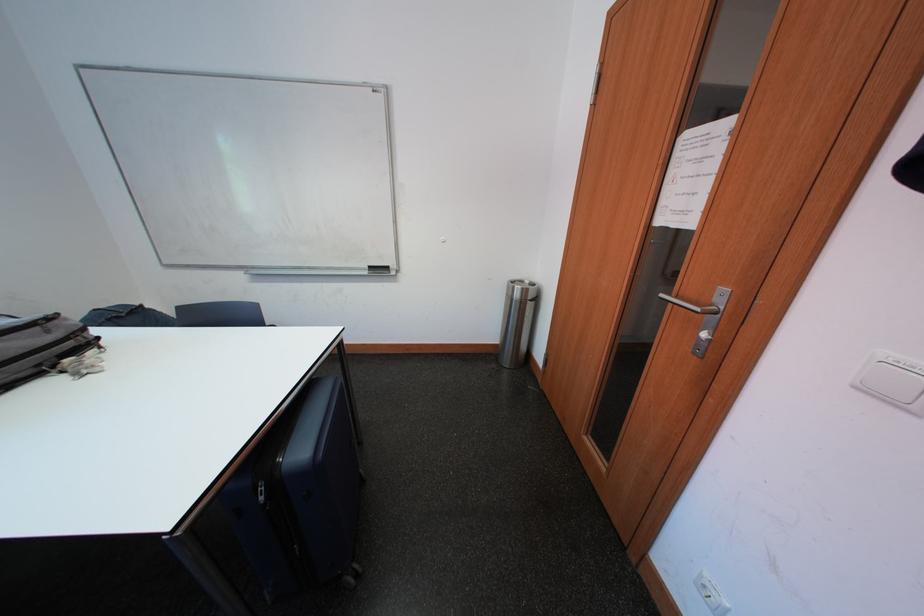
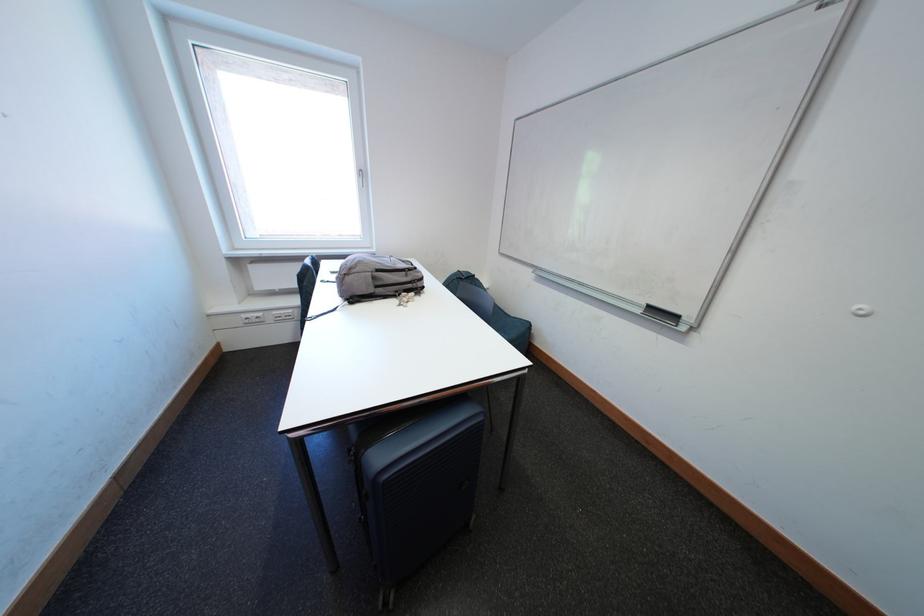
In the second image, find the point that corresponds to (x=49, y=369) in the first image.

(406, 294)